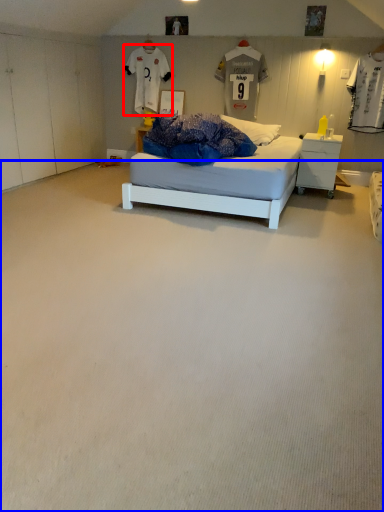
Question: Which object is further to the camera taking this photo, t shirt (highlighted by a red box) or plain (highlighted by a blue box)?

Choices:
 (A) t shirt
 (B) plain

Answer: (A)